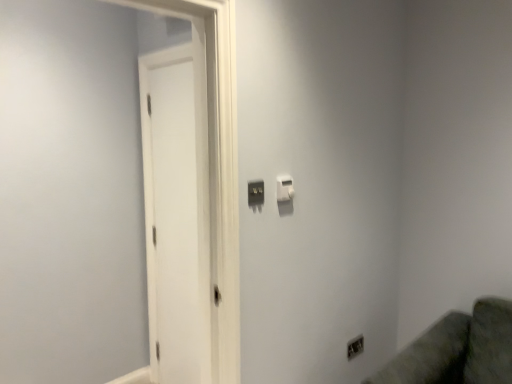
Describe the element at coordinates (284, 188) in the screenshot. The image size is (512, 384). I see `white plastic light switch at upper center, which appears as the 2th light switch when viewed from the left` at that location.

Image resolution: width=512 pixels, height=384 pixels. I want to click on white matte door at left, so click(x=177, y=211).

Considering the positions of objects matte black switch at center, which is the 1th light switch from left to right, and white matte door at left in the image provided, who is behind, matte black switch at center, which is the 1th light switch from left to right, or white matte door at left?

white matte door at left is more distant.

Considering the relative sizes of matte black switch at center, which ranks as the second light switch in back-to-front order, and white matte door at left in the image provided, is matte black switch at center, which ranks as the second light switch in back-to-front order, taller than white matte door at left?

In fact, matte black switch at center, which ranks as the second light switch in back-to-front order, may be shorter than white matte door at left.

From the image's perspective, relative to white matte door at left, is matte black switch at center, which is the 1th light switch from left to right, above or below?

From the image's perspective, matte black switch at center, which is the 1th light switch from left to right, appears above white matte door at left.

Is matte black switch at center, which ranks as the second light switch in back-to-front order, in contact with white matte door at left?

No, matte black switch at center, which ranks as the second light switch in back-to-front order, is not touching white matte door at left.

Between point (348, 347) and point (280, 177), which one is positioned in front?

The point (280, 177) is more forward.

Which is more to the left, satin silver outlet at lower right or white plastic light switch at upper center, which appears as the 2th light switch when viewed from the left?

white plastic light switch at upper center, which appears as the 2th light switch when viewed from the left.

Is white plastic light switch at upper center, which is the first light switch in back-to-front order, a part of satin silver outlet at lower right?

No.

Is satin silver outlet at lower right behind white plastic light switch at upper center, the 2th light switch when ordered from front to back?

Yes, the depth of satin silver outlet at lower right is greater than that of white plastic light switch at upper center, the 2th light switch when ordered from front to back.

Between point (289, 181) and point (263, 188), which one is positioned behind?

Point (289, 181)

Which of these two, white plastic light switch at upper center, acting as the first light switch starting from the right, or matte black switch at center, which ranks as the second light switch in back-to-front order, is smaller?

Smaller between the two is matte black switch at center, which ranks as the second light switch in back-to-front order.

Is white plastic light switch at upper center, which is the first light switch in back-to-front order, with matte black switch at center, which ranks as the second light switch in back-to-front order?

No.

Can you confirm if white plastic light switch at upper center, which is the first light switch in back-to-front order, is wider than matte black switch at center, which is the first light switch in front-to-back order?

Correct, the width of white plastic light switch at upper center, which is the first light switch in back-to-front order, exceeds that of matte black switch at center, which is the first light switch in front-to-back order.

Is white plastic light switch at upper center, the 2th light switch when ordered from front to back, closer to camera compared to satin silver outlet at lower right?

Yes.

This screenshot has height=384, width=512. I want to click on light switch that is the 1st one when counting leftward from the satin silver outlet at lower right, so pyautogui.click(x=284, y=188).

Based on the photo, is white plastic light switch at upper center, the 2th light switch when ordered from front to back, facing towards satin silver outlet at lower right?

No, white plastic light switch at upper center, the 2th light switch when ordered from front to back, is not aimed at satin silver outlet at lower right.

Considering the relative positions of white matte door at left and satin silver outlet at lower right in the image provided, is white matte door at left to the right of satin silver outlet at lower right from the viewer's perspective?

No, white matte door at left is not to the right of satin silver outlet at lower right.

Could you tell me if white matte door at left is turned towards satin silver outlet at lower right?

No.

Is white matte door at left thinner than satin silver outlet at lower right?

No, white matte door at left is not thinner than satin silver outlet at lower right.

From a real-world perspective, does white matte door at left sit lower than satin silver outlet at lower right?

No.

From a real-world perspective, is satin silver outlet at lower right physically located above or below white matte door at left?

Clearly, from a real-world perspective, satin silver outlet at lower right is below white matte door at left.

Based on the photo, from the image's perspective, is satin silver outlet at lower right above white matte door at left?

Incorrect, from the image's perspective, satin silver outlet at lower right is lower than white matte door at left.

Which of these two, satin silver outlet at lower right or white matte door at left, is smaller?

satin silver outlet at lower right.

I want to click on screen door that appears above the satin silver outlet at lower right (from a real-world perspective), so click(x=177, y=211).

In terms of height, does matte black switch at center, which is the first light switch in front-to-back order, look taller or shorter compared to white plastic light switch at upper center, the 2th light switch when ordered from front to back?

Clearly, matte black switch at center, which is the first light switch in front-to-back order, is taller compared to white plastic light switch at upper center, the 2th light switch when ordered from front to back.

Is white plastic light switch at upper center, acting as the first light switch starting from the right, inside matte black switch at center, which is the 1th light switch from left to right?

No, matte black switch at center, which is the 1th light switch from left to right, does not contain white plastic light switch at upper center, acting as the first light switch starting from the right.

Can you tell me how much matte black switch at center, which ranks as the second light switch in back-to-front order, and white plastic light switch at upper center, acting as the first light switch starting from the right, differ in facing direction?

The angular difference between matte black switch at center, which ranks as the second light switch in back-to-front order, and white plastic light switch at upper center, acting as the first light switch starting from the right, is 2.31 degrees.

Considering the sizes of objects matte black switch at center, which ranks as the second light switch in back-to-front order, and white plastic light switch at upper center, which is the first light switch in back-to-front order, in the image provided, who is smaller, matte black switch at center, which ranks as the second light switch in back-to-front order, or white plastic light switch at upper center, which is the first light switch in back-to-front order,?

With smaller size is matte black switch at center, which ranks as the second light switch in back-to-front order.

At what (x,y) coordinates should I click in order to perform the action: click on screen door to the left of matte black switch at center, which is the first light switch in front-to-back order. Please return your answer as a coordinate pair (x, y). Image resolution: width=512 pixels, height=384 pixels. Looking at the image, I should click on (177, 211).

Locate an element on the screen. The width and height of the screenshot is (512, 384). the 2nd light switch positioned above the satin silver outlet at lower right (from the image's perspective) is located at coordinates (284, 188).

Considering their positions, is white plastic light switch at upper center, which is the first light switch in back-to-front order, positioned closer to matte black switch at center, which is the 1th light switch from left to right, than white matte door at left?

white plastic light switch at upper center, which is the first light switch in back-to-front order.

When comparing their distances from white matte door at left, does satin silver outlet at lower right or matte black switch at center, which is the second light switch in right-to-left order, seem closer?

matte black switch at center, which is the second light switch in right-to-left order, is closer to white matte door at left.

Which object lies nearer to the anchor point white matte door at left, satin silver outlet at lower right or white plastic light switch at upper center, the 2th light switch when ordered from front to back?

The object closer to white matte door at left is white plastic light switch at upper center, the 2th light switch when ordered from front to back.

Considering their positions, is white plastic light switch at upper center, the 2th light switch when ordered from front to back, positioned closer to matte black switch at center, which is the first light switch in front-to-back order, than satin silver outlet at lower right?

white plastic light switch at upper center, the 2th light switch when ordered from front to back, is closer to matte black switch at center, which is the first light switch in front-to-back order.

In the scene shown: From the image, which object appears to be nearer to white plastic light switch at upper center, acting as the first light switch starting from the right, satin silver outlet at lower right or matte black switch at center, which is the first light switch in front-to-back order?

Among the two, matte black switch at center, which is the first light switch in front-to-back order, is located nearer to white plastic light switch at upper center, acting as the first light switch starting from the right.

Estimate the real-world distances between objects in this image. Which object is further from satin silver outlet at lower right, matte black switch at center, which ranks as the second light switch in back-to-front order, or white matte door at left?

white matte door at left.

Estimate the real-world distances between objects in this image. Which object is further from satin silver outlet at lower right, white matte door at left or white plastic light switch at upper center, the 2th light switch when ordered from front to back?

The object further to satin silver outlet at lower right is white matte door at left.

When comparing their distances from satin silver outlet at lower right, does white plastic light switch at upper center, acting as the first light switch starting from the right, or white matte door at left seem closer?

Based on the image, white plastic light switch at upper center, acting as the first light switch starting from the right, appears to be nearer to satin silver outlet at lower right.

Find the location of a particular element. Image resolution: width=512 pixels, height=384 pixels. light switch between white plastic light switch at upper center, the 2th light switch when ordered from front to back, and satin silver outlet at lower right vertically is located at coordinates (256, 192).

This screenshot has width=512, height=384. Identify the location of light switch situated between white matte door at left and white plastic light switch at upper center, the 2th light switch when ordered from front to back, from left to right. (256, 192).